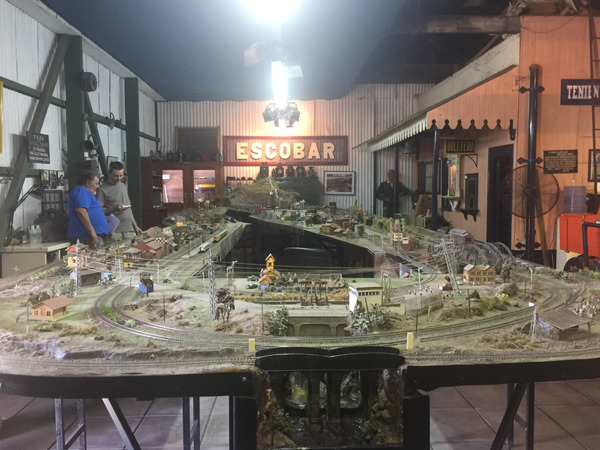
This screenshot has width=600, height=450. Identify the location of light. (281, 89).